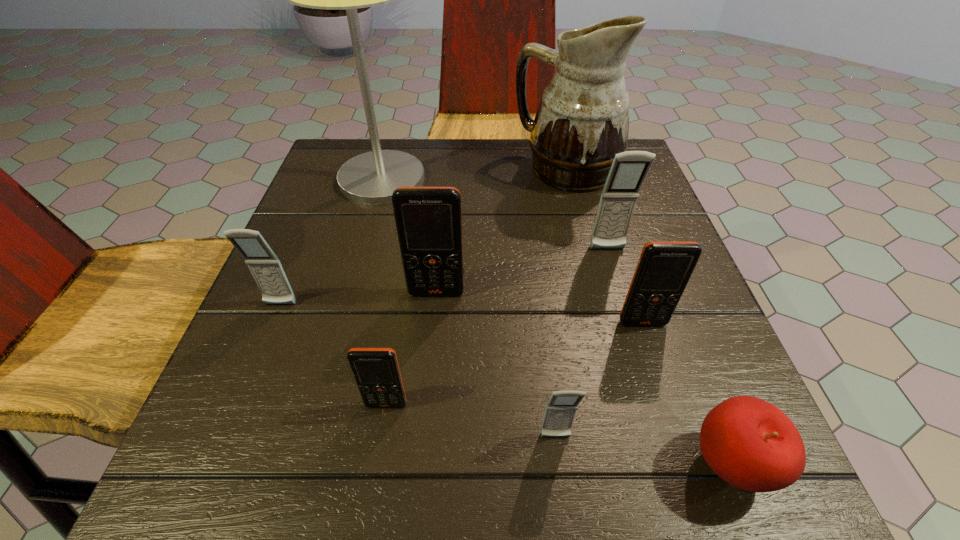
I want to click on the sixth farthest object, so click(x=664, y=268).

Locate an element on the screen. the third nearest object is located at coordinates (376, 371).

The height and width of the screenshot is (540, 960). What are the coordinates of `the second nearest cellular telephone` in the screenshot? It's located at coord(376,371).

This screenshot has width=960, height=540. I want to click on the smallest gray cellular telephone, so click(560, 411).

Identify the location of the second gray cellular telephone from right to left. pos(560,411).

You are a GUI agent. You are given a task and a screenshot of the screen. Output one action in this format:
    pyautogui.click(x=<x>, y=<y>)
    Task: Click on the red apple
    
    Given the screenshot: What is the action you would take?
    pyautogui.click(x=751, y=444)

This screenshot has width=960, height=540. I want to click on apple, so [x=751, y=444].

Identify the location of free spot located 0.160m on the front of the tallest object. (361, 255).

In order to click on free space located 0.220m from the spout of the eighth shortest object in this screenshot , I will do `click(423, 169)`.

The height and width of the screenshot is (540, 960). Find the location of `vacant region located from the spout of the eighth shortest object`. vacant region located from the spout of the eighth shortest object is located at coordinates (357, 169).